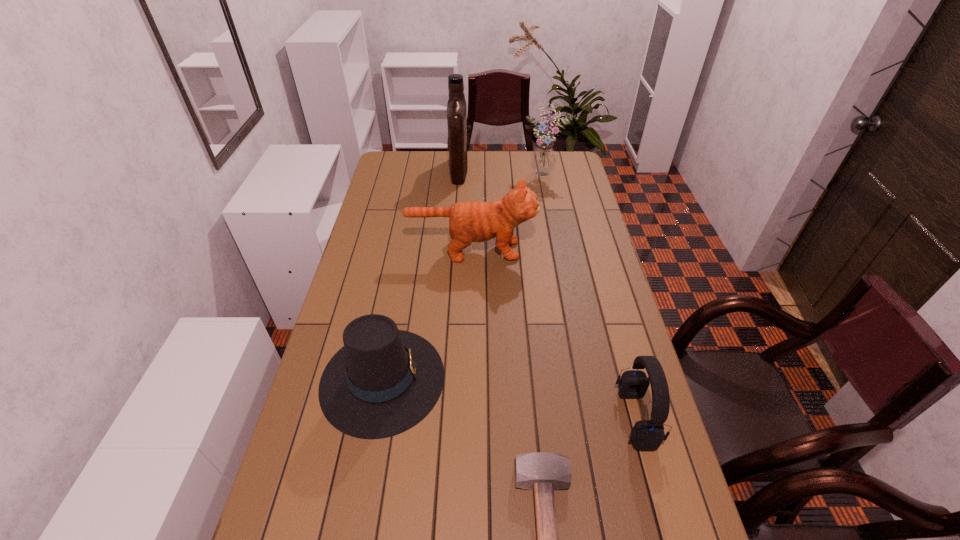
I want to click on the tallest object, so click(x=456, y=106).

The image size is (960, 540). In order to click on bouquet in this screenshot , I will do `click(543, 161)`.

Where is `the third tallest object`? This screenshot has height=540, width=960. the third tallest object is located at coordinates (474, 221).

Identify the location of the fourth nearest object. 474,221.

Locate an element on the screen. hat is located at coordinates click(x=384, y=381).

Find the location of `headset`. headset is located at coordinates (647, 435).

What are the coordinates of `vacant area situated 0.130m on the label side of the liquor` in the screenshot? It's located at (496, 170).

The image size is (960, 540). What are the coordinates of `free region located 0.100m on the front-facing side of the bouquet` in the screenshot? It's located at (551, 196).

The height and width of the screenshot is (540, 960). Find the location of `free space located on the face of the fourth nearest object`. free space located on the face of the fourth nearest object is located at coordinates (x=582, y=250).

Locate an element on the screen. vacant space positioned 0.310m on the front-facing side of the hat is located at coordinates (557, 379).